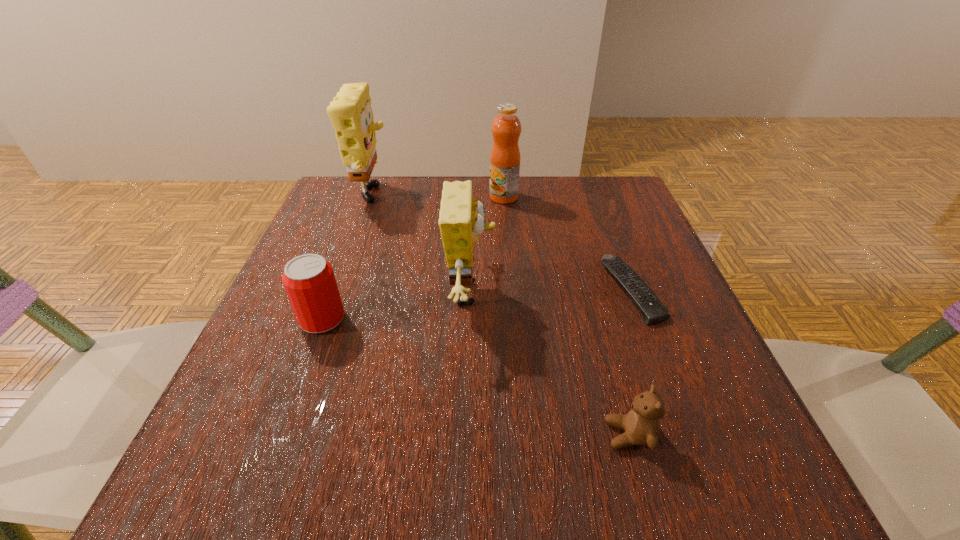
The height and width of the screenshot is (540, 960). Find the location of `the left sponge`. the left sponge is located at coordinates (351, 115).

You are a GUI agent. You are given a task and a screenshot of the screen. Output one action in this format:
    pyautogui.click(x=<x>, y=<y>)
    Task: Click on the farther sponge
    This screenshot has width=960, height=540.
    Given the screenshot: What is the action you would take?
    pyautogui.click(x=351, y=115)

Image resolution: width=960 pixels, height=540 pixels. Find the location of `fruit juice`. fruit juice is located at coordinates (506, 128).

Where is `the nearer sponge`? Image resolution: width=960 pixels, height=540 pixels. the nearer sponge is located at coordinates (461, 222).

I want to click on the shorter sponge, so click(x=461, y=222).

The image size is (960, 540). Find the location of `beer can`. beer can is located at coordinates (309, 281).

Find the location of a particular element. the fifth object from left to right is located at coordinates (641, 425).

You are a GUI agent. You are given a task and a screenshot of the screen. Output one action in this format:
    pyautogui.click(x=<x>, y=<y>)
    Task: Click on the second shortest object
    The image size is (960, 540).
    Given the screenshot: What is the action you would take?
    pyautogui.click(x=641, y=425)

Identify the location of the rightmost object. The height and width of the screenshot is (540, 960). (652, 310).

Identify the location of remote control. The image size is (960, 540). (652, 310).